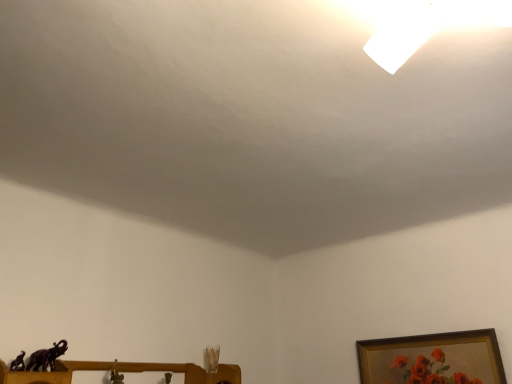
You are a GUI agent. You are given a task and a screenshot of the screen. Output one action in this format:
    pyautogui.click(x=<x>, y=<y>)
    Task: Click on the gold-framed painting at lower right
    Image resolution: width=512 pixels, height=384 pixels.
    Given the screenshot: What is the action you would take?
    pyautogui.click(x=433, y=355)

Image resolution: width=512 pixels, height=384 pixels. What do you see at coordinates (433, 355) in the screenshot?
I see `gold-framed painting at lower right` at bounding box center [433, 355].

Locate an element on the screen. The image size is (512, 384). gold-framed painting at lower right is located at coordinates (433, 355).